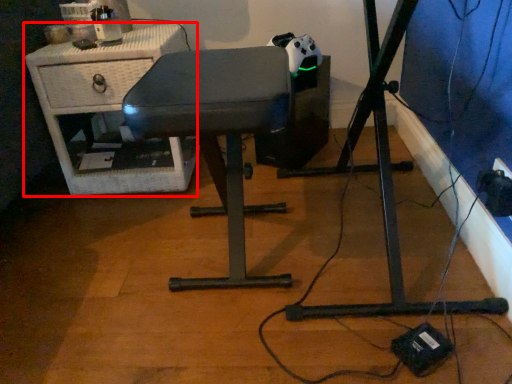
Question: Observing the image, what is the correct spatial positioning of furniture (annotated by the red box) in reference to furniture?

Choices:
 (A) right
 (B) left

Answer: (B)